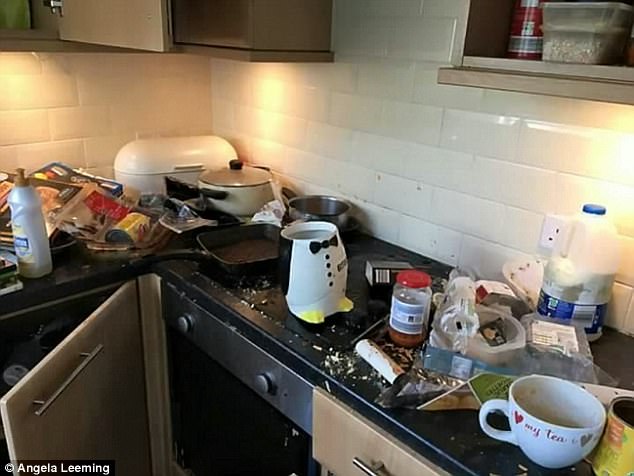
The width and height of the screenshot is (634, 476). Identify the location of coffee mug. (529, 424).